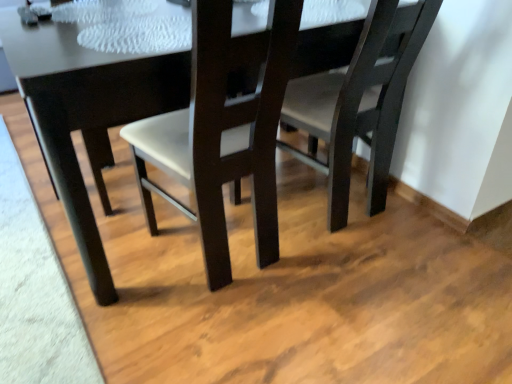
Where is `unoccupied region to the right of matte dark wood chair at center, which ranks as the first chair in left-to-right order`? unoccupied region to the right of matte dark wood chair at center, which ranks as the first chair in left-to-right order is located at coordinates (x=359, y=282).